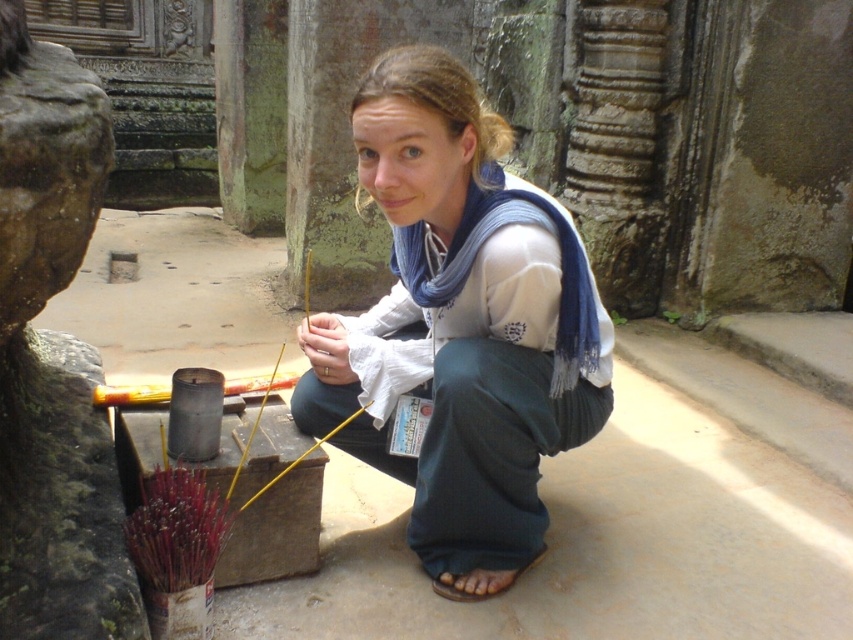
Can you confirm if white cotton scarf at center is shorter than smooth stone statue at left?

No.

Does white cotton scarf at center have a larger size compared to smooth stone statue at left?

No, white cotton scarf at center is not bigger than smooth stone statue at left.

This screenshot has height=640, width=853. What do you see at coordinates (460, 324) in the screenshot? I see `white cotton scarf at center` at bounding box center [460, 324].

Identify the location of white cotton scarf at center. (460, 324).

Who is shorter, smooth stone statue at left or brown leather sandal at lower center?

Standing shorter between the two is brown leather sandal at lower center.

This screenshot has height=640, width=853. What do you see at coordinates (51, 356) in the screenshot?
I see `smooth stone statue at left` at bounding box center [51, 356].

Who is more forward, (x=61, y=557) or (x=520, y=572)?

Point (x=61, y=557)

The width and height of the screenshot is (853, 640). I want to click on smooth stone statue at left, so click(x=51, y=356).

Is white cotton scarf at center in front of brown leather sandal at lower center?

Yes, white cotton scarf at center is closer to the viewer.

Is white cotton scarf at center wider than brown leather sandal at lower center?

Indeed, white cotton scarf at center has a greater width compared to brown leather sandal at lower center.

Locate an element on the screen. Image resolution: width=853 pixels, height=640 pixels. white cotton scarf at center is located at coordinates (460, 324).

Find the location of a particular element. This screenshot has width=853, height=640. white cotton scarf at center is located at coordinates (460, 324).